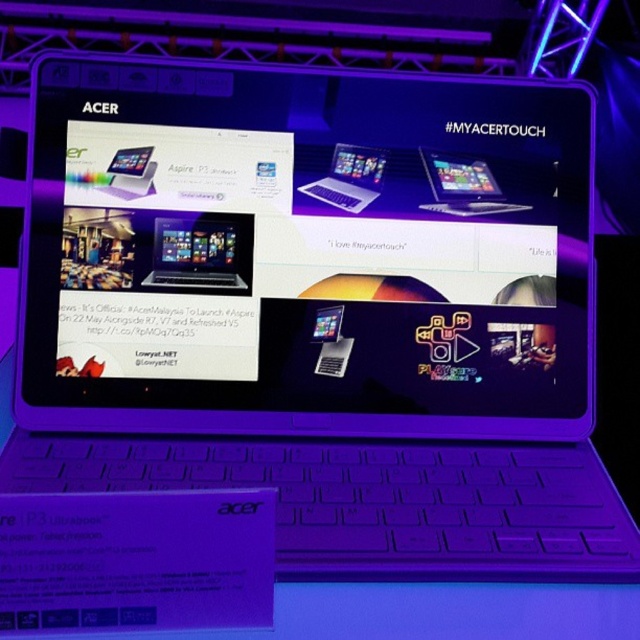
Question: Which point appears closest to the camera in this image?

Choices:
 (A) (195, 243)
 (B) (353, 182)

Answer: (A)

Question: Which point appears closest to the camera in this image?

Choices:
 (A) (349, 198)
 (B) (160, 234)
 (C) (484, 164)

Answer: (B)

Question: Can you confirm if silver metallic laptop at center is positioned below sleek silver laptop at center?

Choices:
 (A) yes
 (B) no

Answer: (A)

Question: From the image, what is the correct spatial relationship of matte black laptop at center in relation to sleek silver laptop at center?

Choices:
 (A) left
 (B) right

Answer: (A)

Question: Which of these objects is positioned closest to the sleek silver laptop at center?

Choices:
 (A) matte black laptop at center
 (B) silver metallic laptop at center

Answer: (B)

Question: Is matte black laptop at center to the right of silver metallic laptop at center from the viewer's perspective?

Choices:
 (A) yes
 (B) no

Answer: (B)